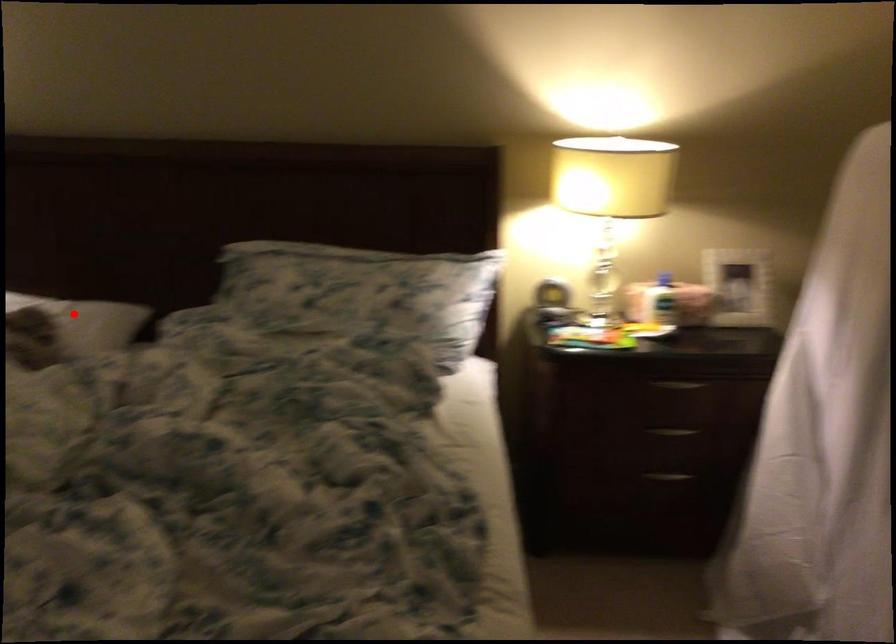
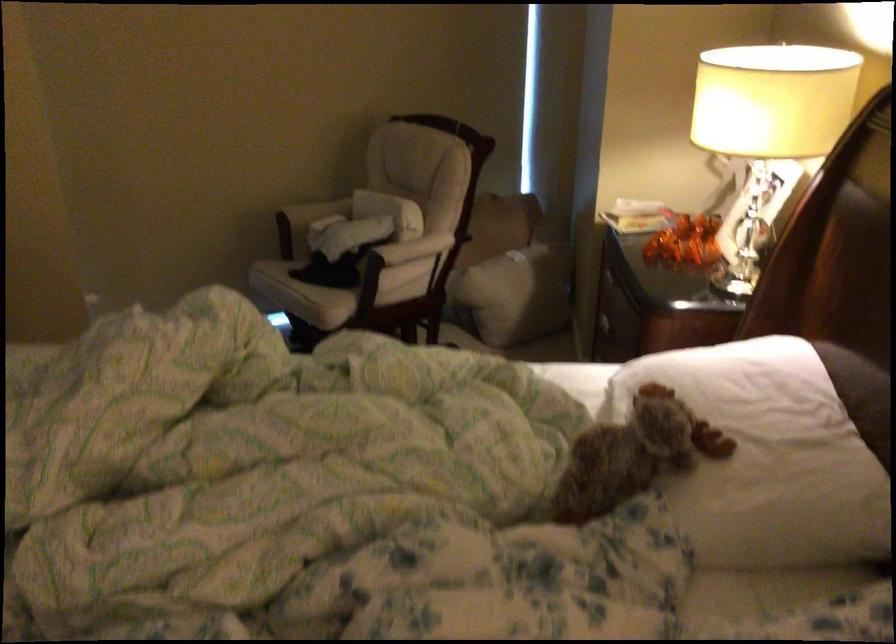
Question: I am providing you with two images of the same scene from different viewpoints. Given a red point in image1, look at the same physical point in image2. Is it:

Choices:
 (A) Closer to the viewpoint
 (B) Farther from the viewpoint

Answer: (A)